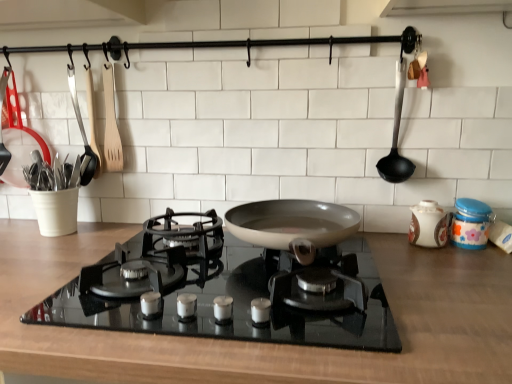
Locate an element on the screen. free space between black glass gas stove at center and blue glossy jar at right, the 5th kitchen appliance from the left is located at coordinates (421, 274).